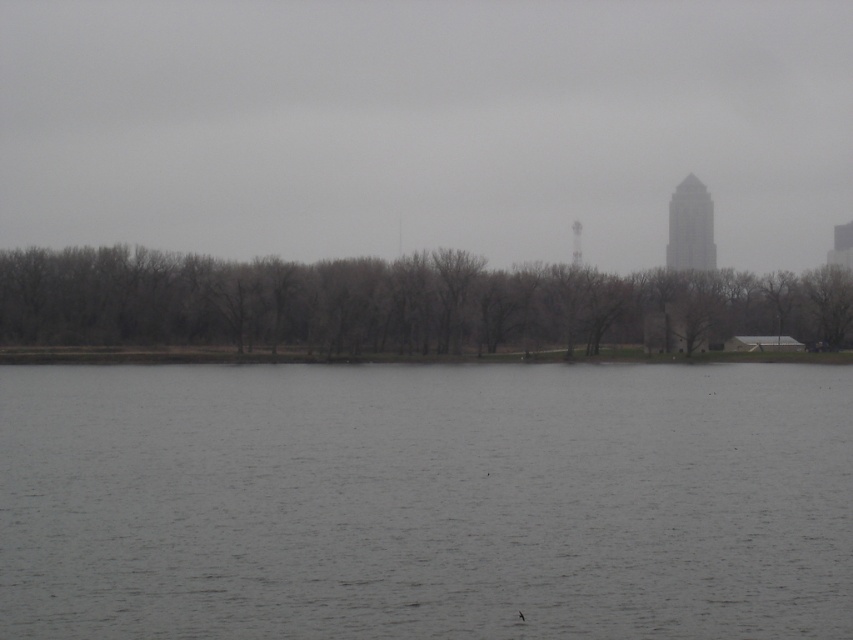
You are standing at the point with coordinates point (292, 497) and want to walk towards the point with coordinates point (456, 342). Which direction should you move to get closer to your destination?

You should move backward because point (292, 497) is in front of point (456, 342). Moving backward would bring you closer to your destination.